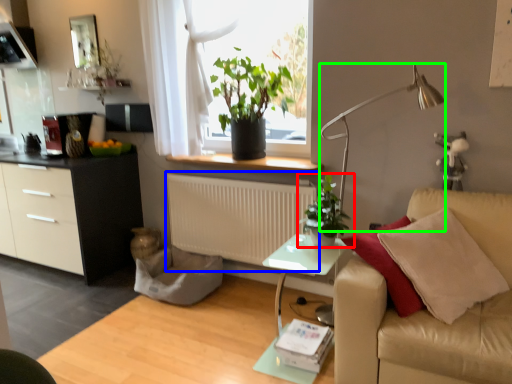
Question: Which object is positioned farthest from houseplant (highlighted by a red box)? Select from radiator (highlighted by a blue box) and lamp (highlighted by a green box).

Choices:
 (A) radiator
 (B) lamp

Answer: (A)